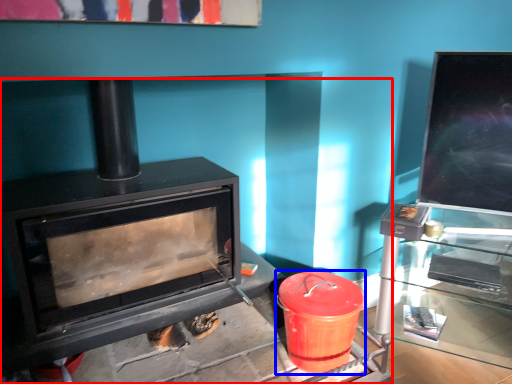
Question: Which object is further to the camera taking this photo, wood burning stove (highlighted by a red box) or crock pot (highlighted by a blue box)?

Choices:
 (A) wood burning stove
 (B) crock pot

Answer: (B)